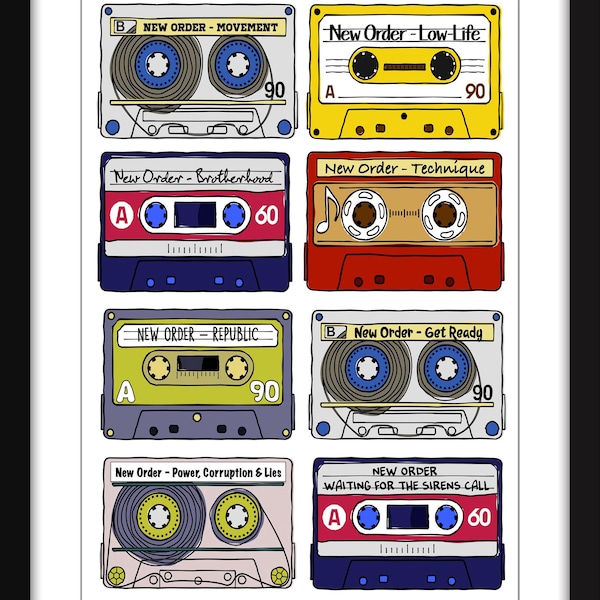
Where is `clear, see through tape`? This screenshot has height=600, width=600. clear, see through tape is located at coordinates (278, 517), (323, 392), (204, 87).